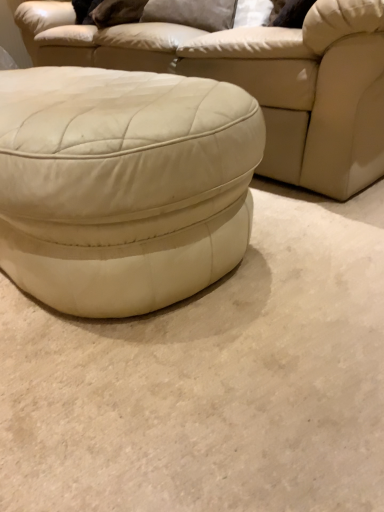
Question: Is suede-like gray pillow at upper center wider than white leather ottoman at center?

Choices:
 (A) yes
 (B) no

Answer: (B)

Question: Is suede-like gray pillow at upper center taller than white leather ottoman at center?

Choices:
 (A) no
 (B) yes

Answer: (A)

Question: Does suede-like gray pillow at upper center have a lesser width compared to white leather ottoman at center?

Choices:
 (A) yes
 (B) no

Answer: (A)

Question: Is the position of suede-like gray pillow at upper center more distant than that of white leather ottoman at center?

Choices:
 (A) no
 (B) yes

Answer: (B)

Question: Is suede-like gray pillow at upper center not close to white leather ottoman at center?

Choices:
 (A) no
 (B) yes

Answer: (B)

Question: Is white leather ottoman at center spatially inside white leather ottoman at center, or outside of it?

Choices:
 (A) inside
 (B) outside

Answer: (B)

Question: Considering their positions, is white leather ottoman at center located in front of or behind white leather ottoman at center?

Choices:
 (A) front
 (B) behind

Answer: (B)

Question: Is white leather ottoman at center taller or shorter than white leather ottoman at center?

Choices:
 (A) short
 (B) tall

Answer: (B)

Question: Would you say white leather ottoman at center is to the left or to the right of white leather ottoman at center in the picture?

Choices:
 (A) left
 (B) right

Answer: (A)

Question: In the image, is matte white ottoman at center positioned in front of or behind white leather ottoman at center?

Choices:
 (A) behind
 (B) front

Answer: (A)

Question: Is matte white ottoman at center inside or outside of white leather ottoman at center?

Choices:
 (A) inside
 (B) outside

Answer: (B)

Question: From the image's perspective, is matte white ottoman at center positioned above or below white leather ottoman at center?

Choices:
 (A) below
 (B) above

Answer: (B)

Question: Considering the positions of matte white ottoman at center and white leather ottoman at center in the image, is matte white ottoman at center taller or shorter than white leather ottoman at center?

Choices:
 (A) short
 (B) tall

Answer: (B)

Question: Considering the positions of white leather ottoman at center and white leather ottoman at center in the image, is white leather ottoman at center bigger or smaller than white leather ottoman at center?

Choices:
 (A) small
 (B) big

Answer: (A)

Question: From the image's perspective, is white leather ottoman at center positioned above or below white leather ottoman at center?

Choices:
 (A) below
 (B) above

Answer: (A)